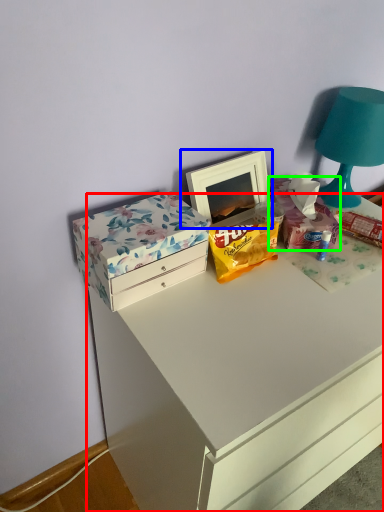
Question: Which object is the farthest from chest of drawers (highlighted by a red box)? Choose among these: picture frame (highlighted by a blue box) or storage box (highlighted by a green box).

Choices:
 (A) picture frame
 (B) storage box

Answer: (A)